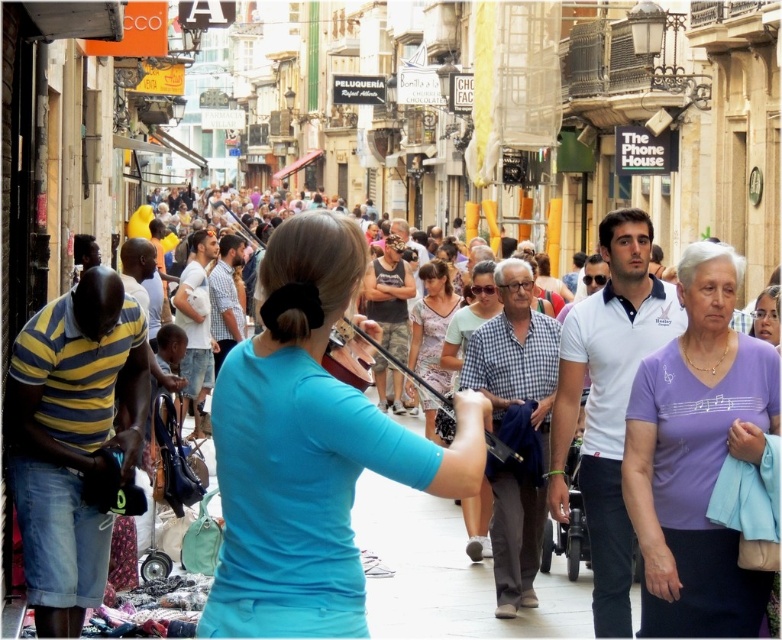
Does purple cotton shirt at center have a larger size compared to printed cotton dress at center?

Indeed, purple cotton shirt at center has a larger size compared to printed cotton dress at center.

Is purple cotton shirt at center positioned in front of printed cotton dress at center?

Yes.

Between point (757, 592) and point (429, 410), which one is positioned in front?

Point (757, 592) is more forward.

Locate an element on the screen. The width and height of the screenshot is (782, 640). purple cotton shirt at center is located at coordinates (x=698, y=456).

Can you confirm if blue matte shirt at center is positioned below purple cotton shirt at center?

Actually, blue matte shirt at center is above purple cotton shirt at center.

The width and height of the screenshot is (782, 640). Identify the location of blue matte shirt at center. (309, 449).

Locate an element on the screen. This screenshot has height=640, width=782. blue matte shirt at center is located at coordinates click(309, 449).

Is point (310, 611) behind point (440, 378)?

No, it is not.

Is blue matte shirt at center smaller than printed cotton dress at center?

No, blue matte shirt at center is not smaller than printed cotton dress at center.

Does point (307, 528) lie in front of point (429, 432)?

Yes, point (307, 528) is closer to viewer.

In order to click on blue matte shirt at center in this screenshot , I will do `click(309, 449)`.